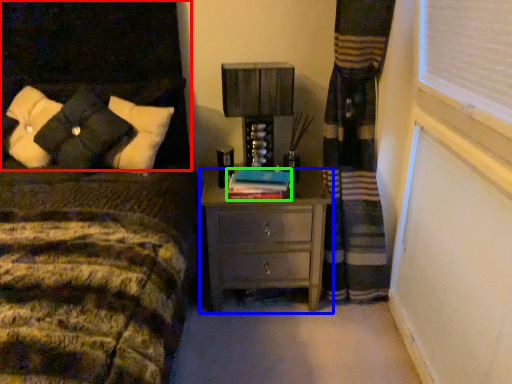
Question: Estimate the real-world distances between objects in this image. Which object is farther from headboard (highlighted by a red box), nightstand (highlighted by a blue box) or book (highlighted by a green box)?

Choices:
 (A) nightstand
 (B) book

Answer: (A)